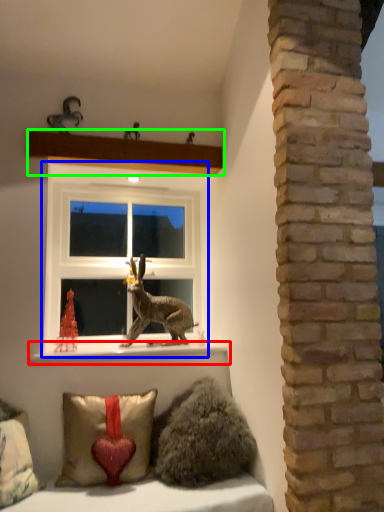
Question: Based on their relative distances, which object is farther from window sill (highlighted by a red box)? Choose from window (highlighted by a blue box) and shelf (highlighted by a green box).

Choices:
 (A) window
 (B) shelf

Answer: (B)